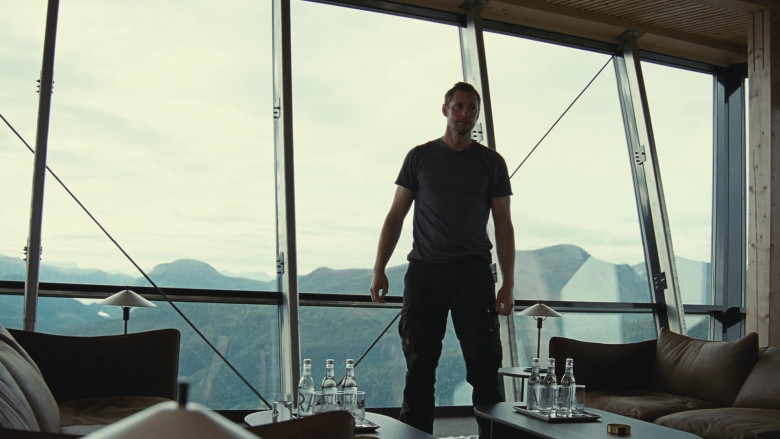
Find the location of a particular element. The image size is (780, 439). windows is located at coordinates (192, 141), (362, 92), (548, 77), (686, 140).